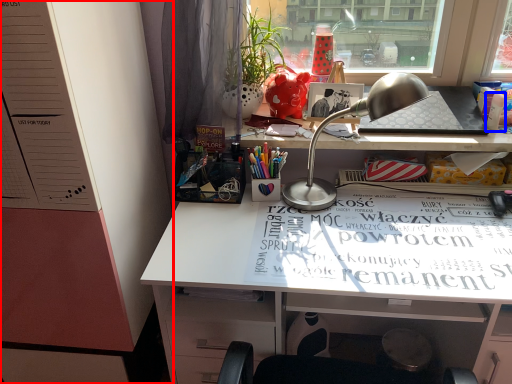
Question: Which object appears closest to the camera in this image, dresser (highlighted by a red box) or stationery (highlighted by a blue box)?

Choices:
 (A) dresser
 (B) stationery

Answer: (A)